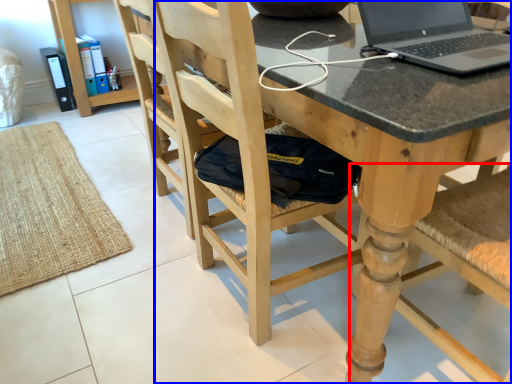
Question: Which point is further to the camera, chair (highlighted by a red box) or chair (highlighted by a blue box)?

Choices:
 (A) chair
 (B) chair

Answer: (B)